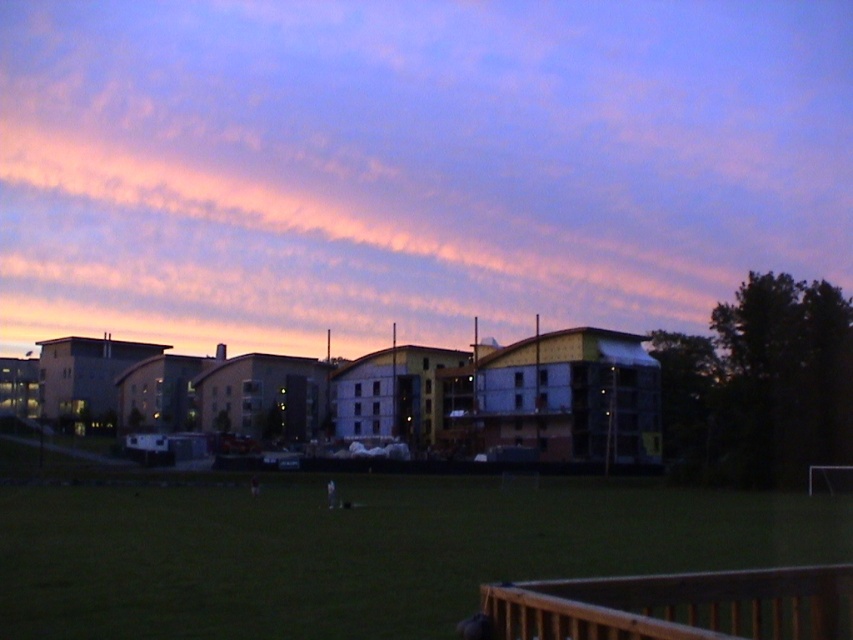
Based on the photo, who is higher up, pink cloud at upper center or green grass at center?

pink cloud at upper center

The height and width of the screenshot is (640, 853). Find the location of `pink cloud at upper center`. pink cloud at upper center is located at coordinates (412, 163).

Does pink cloud at upper center have a lesser height compared to brown wooden rail at lower right?

No.

Is point (543, 289) positioned after point (764, 580)?

Yes, point (543, 289) is behind point (764, 580).

This screenshot has height=640, width=853. Describe the element at coordinates (412, 163) in the screenshot. I see `pink cloud at upper center` at that location.

Find the location of a particular element. Image resolution: width=853 pixels, height=640 pixels. pink cloud at upper center is located at coordinates (412, 163).

Does green grass at center have a larger size compared to brown wooden rail at lower right?

Indeed, green grass at center has a larger size compared to brown wooden rail at lower right.

Does point (706, 493) come in front of point (703, 580)?

That is False.

Is point (157, 513) in front of point (730, 608)?

No, it is not.

I want to click on green grass at center, so click(360, 552).